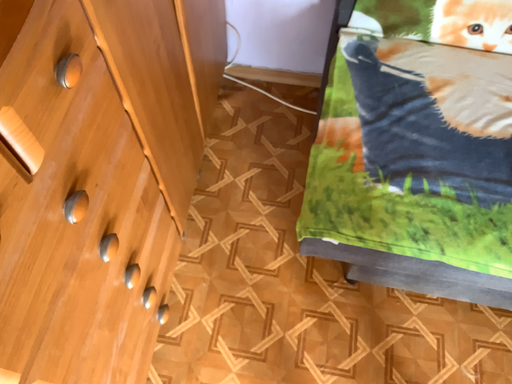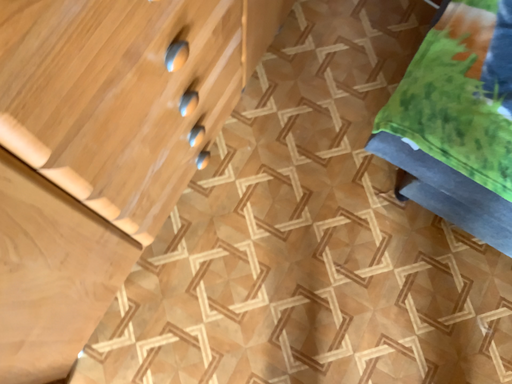
Question: How did the camera likely rotate when shooting the video?

Choices:
 (A) rotated downward
 (B) rotated upward

Answer: (A)